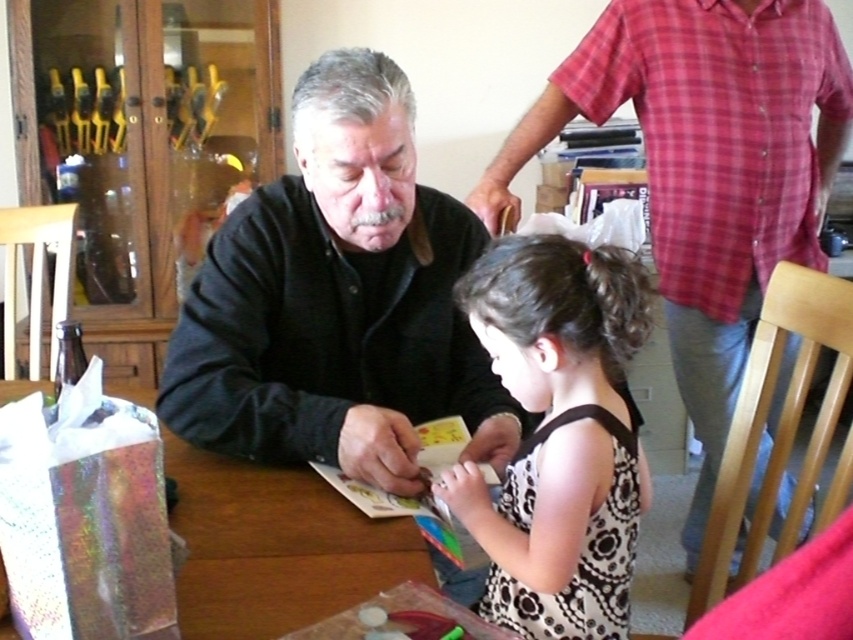
In the scene shown: Is the position of black matte shirt at center less distant than that of matte black sweater at left?

Yes, black matte shirt at center is in front of matte black sweater at left.

Describe the element at coordinates (338, 300) in the screenshot. This screenshot has width=853, height=640. I see `black matte shirt at center` at that location.

Image resolution: width=853 pixels, height=640 pixels. Identify the location of black matte shirt at center. (338, 300).

Between point (584, 420) and point (299, 508), which one is positioned in front?

Positioned in front is point (584, 420).

Is point (584, 548) closer to viewer compared to point (201, 534)?

No, it is not.

Is point (608, 516) positioned behind point (231, 605)?

Yes, point (608, 516) is behind point (231, 605).

The height and width of the screenshot is (640, 853). I want to click on black floral dress at center, so click(x=556, y=435).

Describe the element at coordinates (706, 170) in the screenshot. The height and width of the screenshot is (640, 853). I see `matte black sweater at left` at that location.

From the picture: Which of these two, matte black sweater at left or black floral dress at center, stands taller?

With more height is matte black sweater at left.

Which is in front, point (721, 86) or point (598, 400)?

Positioned in front is point (598, 400).

The height and width of the screenshot is (640, 853). What are the coordinates of `matte black sweater at left` in the screenshot? It's located at (706, 170).